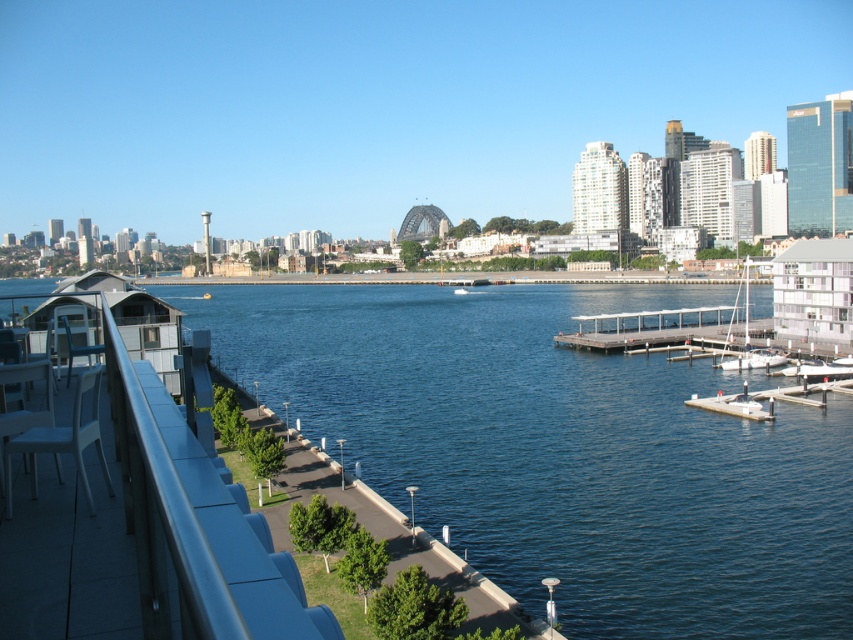
You are standing on the deck and want to walk to the light gray wooden dock at center. If your walking speed is 3 feet per second, how many seconds will it take you to reach the dock?

The light gray wooden dock at center is 314.37 feet away from the viewer. At a walking speed of 3 feet per second, it would take approximately 104.79 seconds to reach the dock.

You are standing on the deck and want to take a photo of the point at coordinates (660, 342). The camera you have can focus up to 300 feet away. Will the point be in focus?

The point at coordinates (660, 342) is 331.30 feet away from the camera, which exceeds the camera focus range of 300 feet. Therefore, the point will not be in focus.